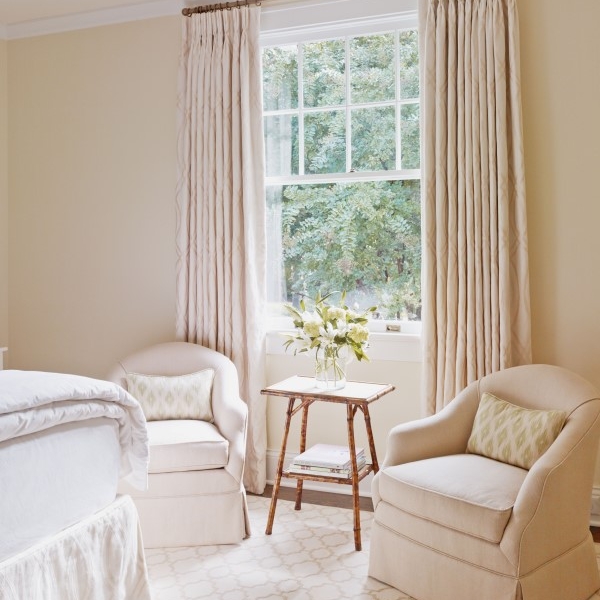
Locate an element on the screen. The image size is (600, 600). white / light beige single seater couches is located at coordinates (178, 453), (455, 499).